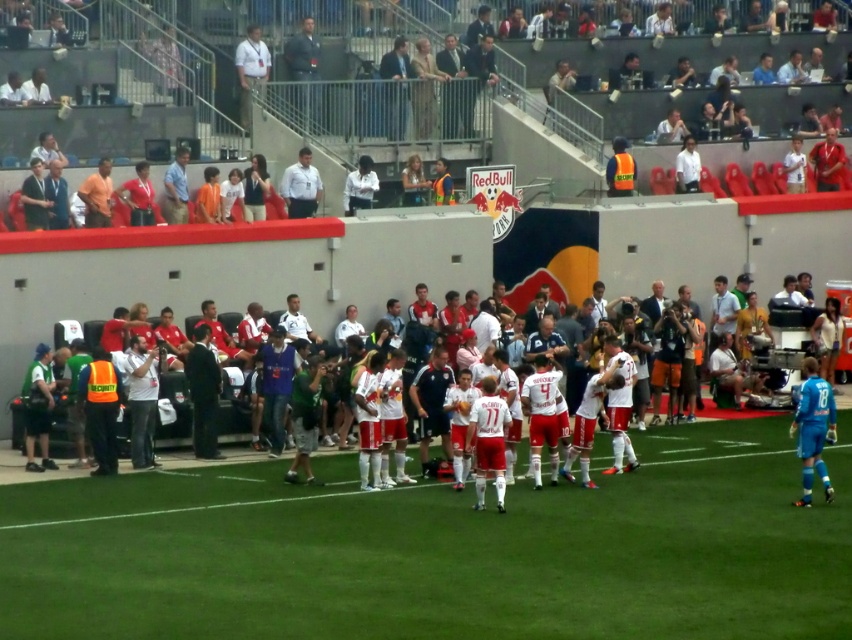
Is blue smooth jersey at right positioned at the back of white matte shirt at center?

No.

The width and height of the screenshot is (852, 640). I want to click on blue smooth jersey at right, so click(x=812, y=428).

Who is positioned more to the right, white synthetic turf at center or white jersey at center?

From the viewer's perspective, white synthetic turf at center appears more on the right side.

Who is positioned more to the left, white synthetic turf at center or white jersey at center?

white jersey at center

At what (x,y) coordinates should I click in order to perform the action: click on white synthetic turf at center. Please return your answer as a coordinate pair (x, y). The height and width of the screenshot is (640, 852). Looking at the image, I should click on (441, 550).

Describe the element at coordinates (709, 452) in the screenshot. Image resolution: width=852 pixels, height=640 pixels. I see `white matte soccer team at center` at that location.

Is point (750, 468) closer to camera compared to point (302, 172)?

That is True.

Is point (833, 461) behind point (286, 186)?

That is False.

Where is `white matte soccer team at center`? The width and height of the screenshot is (852, 640). white matte soccer team at center is located at coordinates (709, 452).